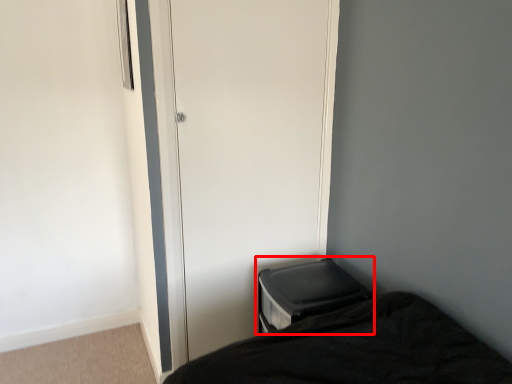
Question: In this image, where is changing table (annotated by the red box) located relative to screen door?

Choices:
 (A) right
 (B) left

Answer: (A)